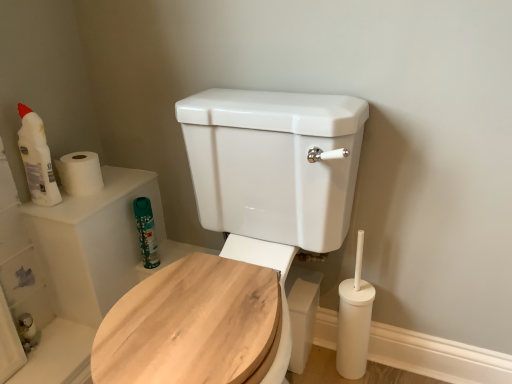
Question: Considering the relative positions of matte white bottle at upper left, the 2th cleaning product when ordered from back to front, and green matte canister at upper left, arranged as the 1th cleaning product when viewed from the back, in the image provided, is matte white bottle at upper left, the 2th cleaning product when ordered from back to front, to the right of green matte canister at upper left, arranged as the 1th cleaning product when viewed from the back, from the viewer's perspective?

Choices:
 (A) yes
 (B) no

Answer: (B)

Question: Does matte white bottle at upper left, placed as the 1th cleaning product when sorted from left to right, lie behind green matte canister at upper left, the 2th cleaning product viewed from the left?

Choices:
 (A) no
 (B) yes

Answer: (A)

Question: Considering the relative sizes of matte white bottle at upper left, which is counted as the second cleaning product, starting from the bottom, and green matte canister at upper left, the 2th cleaning product viewed from the left, in the image provided, is matte white bottle at upper left, which is counted as the second cleaning product, starting from the bottom, bigger than green matte canister at upper left, the 2th cleaning product viewed from the left,?

Choices:
 (A) yes
 (B) no

Answer: (A)

Question: Considering the relative sizes of matte white bottle at upper left, the 2th cleaning product when ordered from back to front, and green matte canister at upper left, which is the first cleaning product from right to left, in the image provided, is matte white bottle at upper left, the 2th cleaning product when ordered from back to front, shorter than green matte canister at upper left, which is the first cleaning product from right to left,?

Choices:
 (A) yes
 (B) no

Answer: (B)

Question: Could you tell me if matte white bottle at upper left, the 2th cleaning product when ordered from back to front, is facing green matte canister at upper left, which is the first cleaning product from right to left?

Choices:
 (A) yes
 (B) no

Answer: (B)

Question: Is matte white bottle at upper left, placed as the 2th cleaning product when sorted from right to left, facing away from green matte canister at upper left, the 2th cleaning product viewed from the left?

Choices:
 (A) yes
 (B) no

Answer: (B)

Question: Can you confirm if white matte toilet paper at upper left is smaller than green matte canister at upper left, which ranks as the 1th cleaning product in bottom-to-top order?

Choices:
 (A) no
 (B) yes

Answer: (A)

Question: Can you confirm if white matte toilet paper at upper left is bigger than green matte canister at upper left, which is the first cleaning product from right to left?

Choices:
 (A) yes
 (B) no

Answer: (A)

Question: Is white matte toilet paper at upper left not within green matte canister at upper left, which is the first cleaning product from right to left?

Choices:
 (A) no
 (B) yes

Answer: (B)

Question: Considering the relative positions of white matte toilet paper at upper left and green matte canister at upper left, which is the first cleaning product from right to left, in the image provided, is white matte toilet paper at upper left to the left of green matte canister at upper left, which is the first cleaning product from right to left, from the viewer's perspective?

Choices:
 (A) no
 (B) yes

Answer: (B)

Question: Is white matte toilet paper at upper left positioned in front of green matte canister at upper left, the 2th cleaning product in the top-to-bottom sequence?

Choices:
 (A) no
 (B) yes

Answer: (B)

Question: From the image's perspective, is white matte toilet paper at upper left on top of green matte canister at upper left, arranged as the 1th cleaning product when viewed from the back?

Choices:
 (A) yes
 (B) no

Answer: (A)

Question: Can you confirm if matte white bottle at upper left, the 2th cleaning product when ordered from back to front, is thinner than white matte toilet paper at upper left?

Choices:
 (A) no
 (B) yes

Answer: (B)